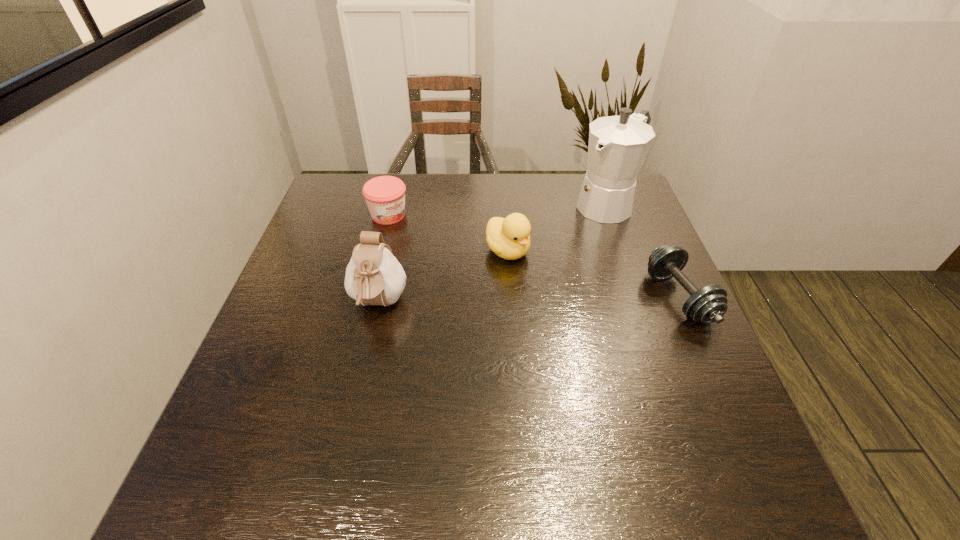
Where is `vacant space in between the jam and the dumbbell`? The width and height of the screenshot is (960, 540). vacant space in between the jam and the dumbbell is located at coordinates (534, 256).

What are the coordinates of `free space between the duck and the coffeepot` in the screenshot? It's located at (558, 227).

Where is `blank region between the jam and the third object from left to right`? blank region between the jam and the third object from left to right is located at coordinates (448, 233).

Identify the location of unoccupied position between the duck and the tallest object. (558, 227).

Locate an element on the screen. free area in between the dumbbell and the second tallest object is located at coordinates (529, 301).

Where is `free space between the jam and the third object from right to left`? Image resolution: width=960 pixels, height=540 pixels. free space between the jam and the third object from right to left is located at coordinates [448, 233].

The image size is (960, 540). Identify the location of free space between the dumbbell and the second tallest object. (529, 301).

Choose which object is the second nearest neighbor to the duck. Please provide its 2D coordinates. Your answer should be formatted as a tuple, i.e. [(x, y)], where the tuple contains the x and y coordinates of a point satisfying the conditions above.

[(374, 276)]

Select which object appears as the third closest to the fourth shortest object. Please provide its 2D coordinates. Your answer should be formatted as a tuple, i.e. [(x, y)], where the tuple contains the x and y coordinates of a point satisfying the conditions above.

[(618, 145)]

The width and height of the screenshot is (960, 540). In order to click on free space that satisfies the following two spatial constraints: 1. on the front side of the jam; 2. on the right side of the third object from left to right in this screenshot , I will do `click(379, 250)`.